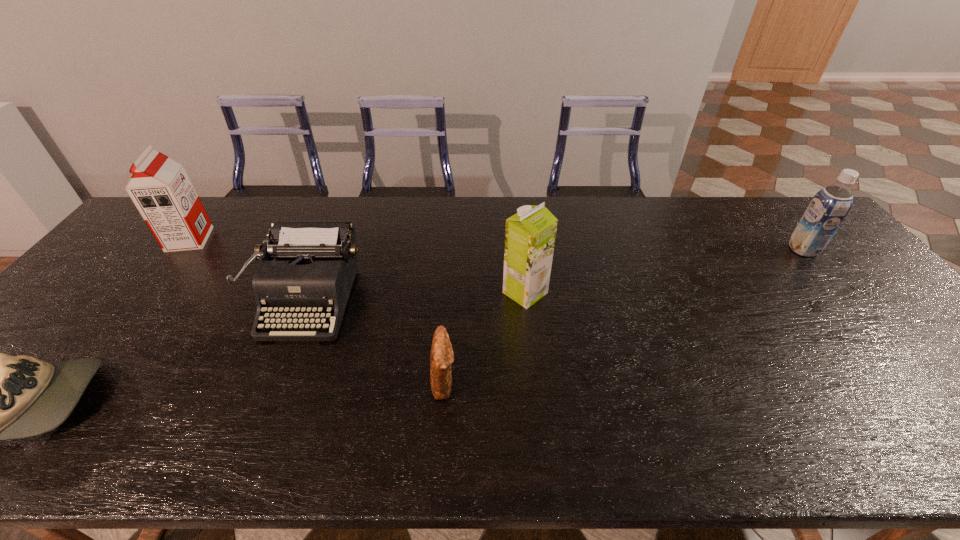
This screenshot has height=540, width=960. Identify the location of vacant space at the near edge. (172, 444).

You are a GUI agent. You are given a task and a screenshot of the screen. Output one action in this format:
    pyautogui.click(x=<x>, y=<y>)
    Task: Click on the free space at the left edge
    This screenshot has height=540, width=960.
    Given the screenshot: What is the action you would take?
    84,321

Identify the location of free location at the right edge. The width and height of the screenshot is (960, 540). (903, 327).

This screenshot has width=960, height=540. I want to click on free space between the second soya milk from left to right and the rightmost soya milk, so click(664, 271).

Where is `free point between the clutch bag and the third object from left to right`? The width and height of the screenshot is (960, 540). free point between the clutch bag and the third object from left to right is located at coordinates (376, 340).

At what (x,y) coordinates should I click in order to perform the action: click on free space between the third object from left to right and the leftmost soya milk. Please return your answer as a coordinate pair (x, y). The image size is (960, 540). Looking at the image, I should click on (250, 269).

Locate an element on the screen. The width and height of the screenshot is (960, 540). unoccupied position between the third object from right to left and the typewriter is located at coordinates (376, 340).

At what (x,y) coordinates should I click in order to perform the action: click on vacant region between the clutch bag and the second soya milk from left to right. Please return your answer as a coordinate pair (x, y). This screenshot has width=960, height=540. Looking at the image, I should click on (485, 336).

Find the location of a particular element. The image size is (960, 540). unoccupied position between the fourth object from right to left and the second shortest object is located at coordinates (376, 340).

Locate an element on the screen. empty space that is in between the rightmost soya milk and the nearest soya milk is located at coordinates (664, 271).